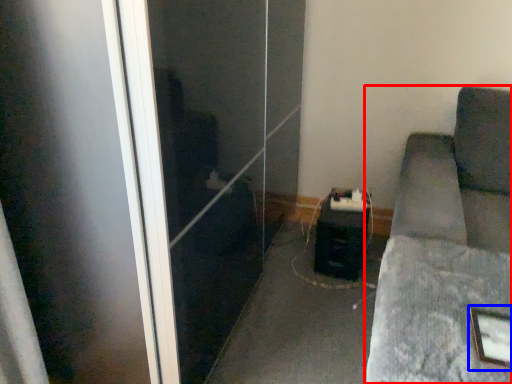
Question: Which point is further to the camera, furniture (highlighted by a red box) or picture frame (highlighted by a blue box)?

Choices:
 (A) furniture
 (B) picture frame

Answer: (B)